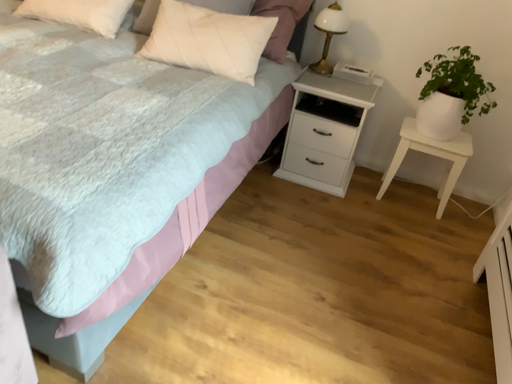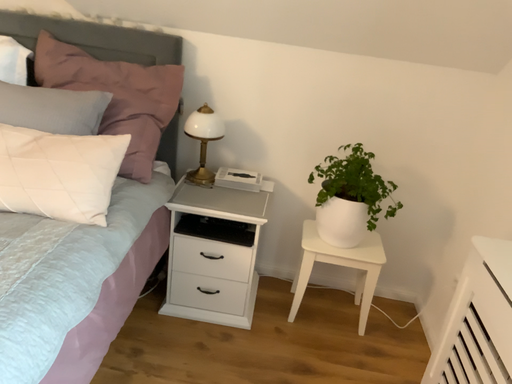
Question: Which way did the camera rotate in the video?

Choices:
 (A) rotated downward
 (B) rotated upward

Answer: (B)